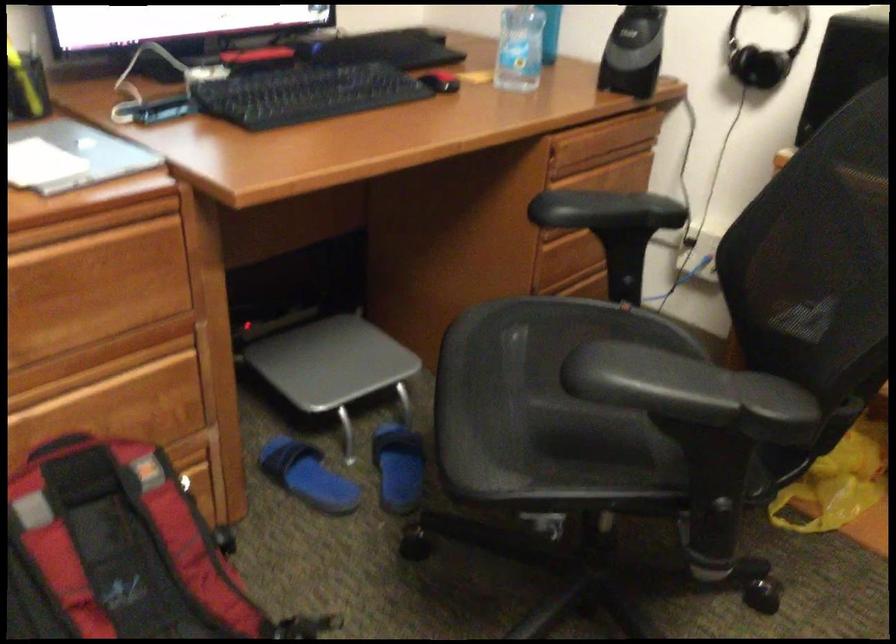
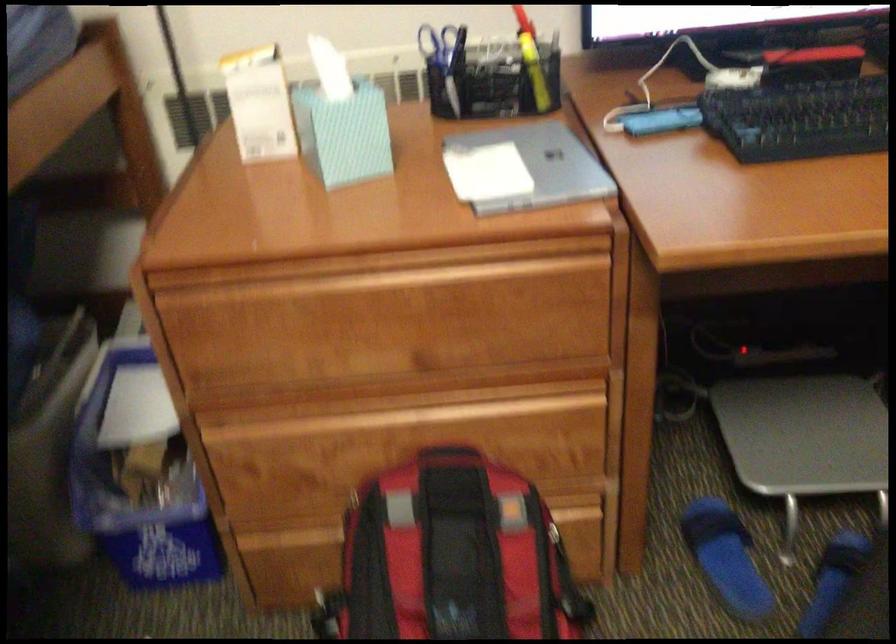
Question: The images are taken continuously from a first-person perspective. In which direction is your viewpoint rotating?

Choices:
 (A) Left
 (B) Right
 (C) Up
 (D) Down

Answer: (A)